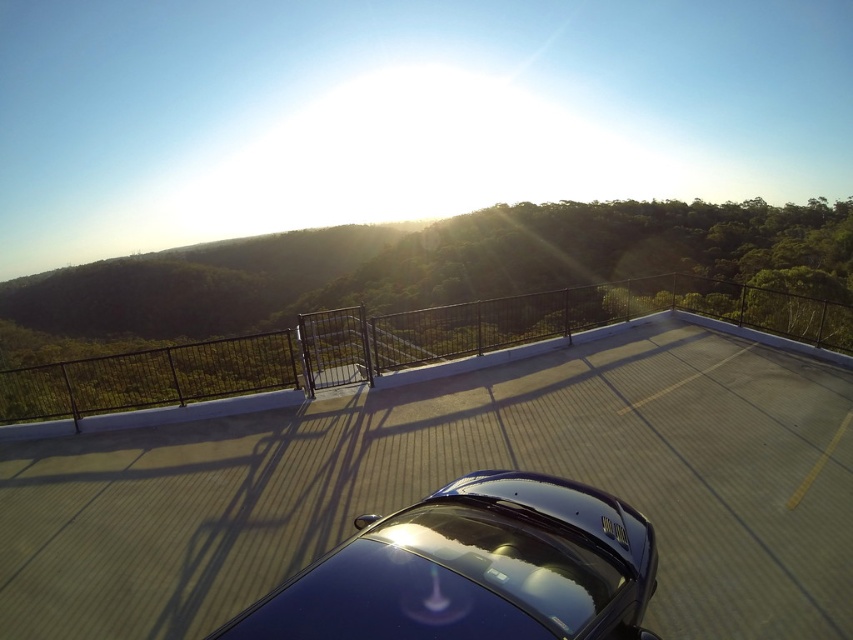
What are the coordinates of the glossy asphalt highway at center?

The glossy asphalt highway at center is located at coordinates point (451,477).

You are standing on the rooftop and want to take a photo of the glossy asphalt highway at center and the glossy blue car at center. Which object should you focus on first if you want both to be in sharp focus?

The glossy asphalt highway at center is much taller than the glossy blue car at center, so focusing on the glossy asphalt highway at center first will help ensure both are in sharp focus because it is farther away.

You are driving a car that is 15 feet long. You see the glossy asphalt highway at center and the glossy blue car at center. Can your car fit between them without touching either?

The distance between the glossy asphalt highway at center and the glossy blue car at center is 6.48 feet. Since your car is 15 feet long, it cannot fit between them without touching either.